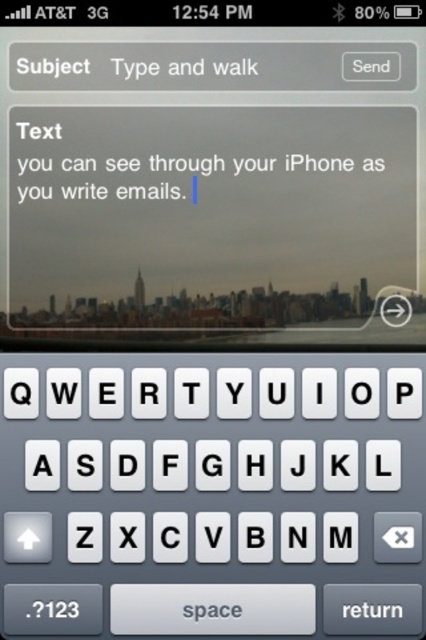
What do you see at coordinates (210, 176) in the screenshot?
I see `transparent glass text field at center` at bounding box center [210, 176].

Where is `transparent glass text field at center`? This screenshot has height=640, width=426. transparent glass text field at center is located at coordinates (x=210, y=176).

The height and width of the screenshot is (640, 426). Find the location of `transparent glass text field at center`. transparent glass text field at center is located at coordinates (210, 176).

Can you confirm if transparent glass text field at center is bigger than transparent plastic text at center?

Yes.

Does transparent glass text field at center appear on the left side of transparent plastic text at center?

Incorrect, transparent glass text field at center is not on the left side of transparent plastic text at center.

Who is more forward, (x=276, y=202) or (x=109, y=157)?

Point (x=109, y=157) is in front.

Find the location of a particular element. transparent glass text field at center is located at coordinates (210, 176).

Is white plastic keyboard at bottom in front of transparent plastic text at center?

Yes.

Does white plastic keyboard at bottom have a lesser width compared to transparent plastic text at center?

Incorrect, white plastic keyboard at bottom's width is not less than transparent plastic text at center's.

The width and height of the screenshot is (426, 640). I want to click on white plastic keyboard at bottom, so [178, 428].